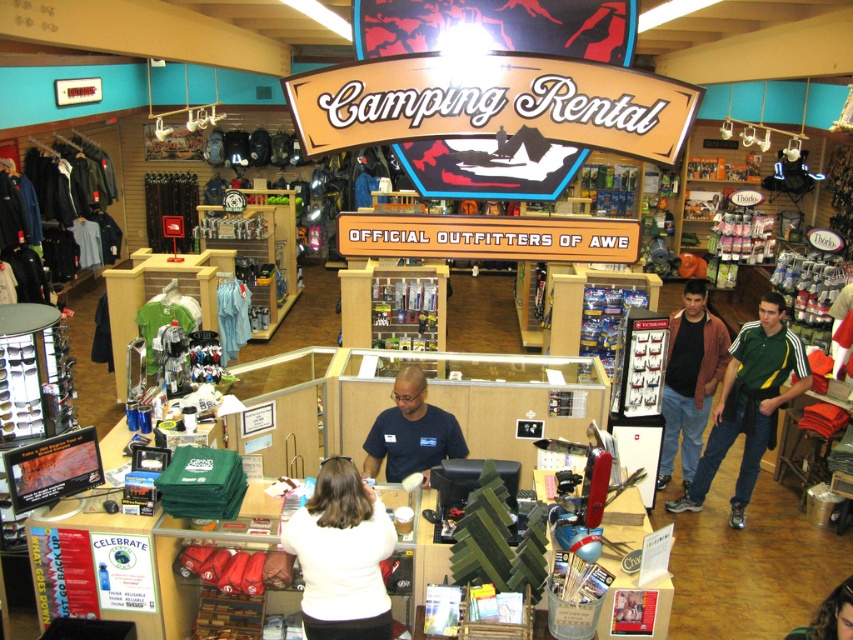
Between white matte shirt at center and blue shirt at center, which one is positioned higher?

blue shirt at center is higher up.

At what (x,y) coordinates should I click in order to perform the action: click on white matte shirt at center. Please return your answer as a coordinate pair (x, y). The width and height of the screenshot is (853, 640). Looking at the image, I should click on (341, 556).

Does white matte shirt at center have a greater width compared to green jersey at center?

Incorrect, white matte shirt at center's width does not surpass green jersey at center's.

The width and height of the screenshot is (853, 640). In order to click on white matte shirt at center in this screenshot , I will do `click(341, 556)`.

Can you confirm if blue shirt at center is positioned above brown leather jacket at lower right?

Yes.

This screenshot has width=853, height=640. In order to click on blue shirt at center in this screenshot , I will do (x=410, y=433).

Locate an element on the screen. This screenshot has width=853, height=640. blue shirt at center is located at coordinates (410, 433).